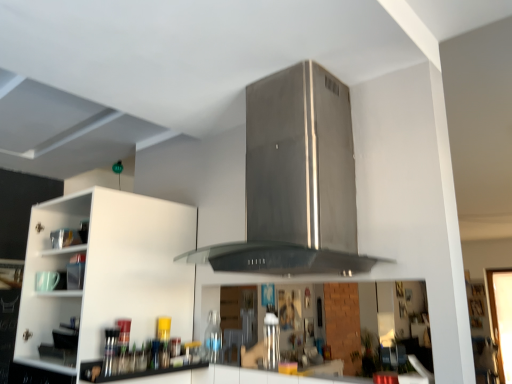
This screenshot has width=512, height=384. What are the coordinates of `stainless steel vent at center` in the screenshot? It's located at (296, 180).

Find the location of a particular element. The width and height of the screenshot is (512, 384). white matte cabinet at left is located at coordinates (106, 273).

Which of these two, transparent glass bottle at center or white matte cabinet at left, is wider?

white matte cabinet at left.

Is transparent glass bottle at center situated inside white matte cabinet at left or outside?

transparent glass bottle at center is spatially situated outside white matte cabinet at left.

What's the angular difference between transparent glass bottle at center and white matte cabinet at left's facing directions?

There is a 2.35-degree angle between the facing directions of transparent glass bottle at center and white matte cabinet at left.

Between transparent glass bottle at center and satin silver canister at center, which one appears on the right side from the viewer's perspective?

satin silver canister at center.

Which is behind, transparent glass bottle at center or satin silver canister at center?

transparent glass bottle at center.

Are transparent glass bottle at center and satin silver canister at center far apart?

They are positioned close to each other.

Based on their positions, is satin silver canister at center located to the left or right of stainless steel vent at center?

satin silver canister at center is positioned on stainless steel vent at center's left side.

Considering the points (274, 324) and (228, 248), which point is behind, point (274, 324) or point (228, 248)?

The point (274, 324) is more distant.

Is satin silver canister at center located outside stainless steel vent at center?

Absolutely, satin silver canister at center is external to stainless steel vent at center.

What's the angular difference between transparent glass bottle at center and stainless steel vent at center's facing directions?

The angle between the facing direction of transparent glass bottle at center and the facing direction of stainless steel vent at center is 2.13 degrees.

From the image's perspective, who appears lower, transparent glass bottle at center or stainless steel vent at center?

transparent glass bottle at center.

Based on the photo, from a real-world perspective, which object rests below the other?

transparent glass bottle at center is physically lower.

Based on the photo, is transparent glass bottle at center in front of or behind stainless steel vent at center in the image?

In the image, transparent glass bottle at center appears behind stainless steel vent at center.

This screenshot has width=512, height=384. Find the location of `cabinetry located above the satin silver canister at center (from a real-world perspective)`. cabinetry located above the satin silver canister at center (from a real-world perspective) is located at coordinates (106, 273).

Is satin silver canister at center completely or partially inside white matte cabinet at left?

That's incorrect, satin silver canister at center is not inside white matte cabinet at left.

Is white matte cabinet at left taller than satin silver canister at center?

Yes, white matte cabinet at left is taller than satin silver canister at center.

Locate an element on the screen. The image size is (512, 384). vent above the transparent glass bottle at center (from the image's perspective) is located at coordinates (296, 180).

Which is correct: stainless steel vent at center is inside transparent glass bottle at center, or outside of it?

stainless steel vent at center cannot be found inside transparent glass bottle at center.

Can you tell me how much stainless steel vent at center and transparent glass bottle at center differ in facing direction?

The facing directions of stainless steel vent at center and transparent glass bottle at center are 2.13 degrees apart.

Considering their positions, is stainless steel vent at center located in front of or behind transparent glass bottle at center?

stainless steel vent at center is in front of transparent glass bottle at center.

Is satin silver canister at center shorter than white matte cabinet at left?

Correct, satin silver canister at center is not as tall as white matte cabinet at left.

From the image's perspective, is satin silver canister at center above or below white matte cabinet at left?

From the image's perspective, satin silver canister at center appears below white matte cabinet at left.

Which object is further away from the camera, satin silver canister at center or white matte cabinet at left?

satin silver canister at center is more distant.

Is white matte cabinet at left at the back of satin silver canister at center?

No, white matte cabinet at left is not at the back of satin silver canister at center.

At what (x,y) coordinates should I click in order to perform the action: click on bottle below the white matte cabinet at left (from the image's perspective). Please return your answer as a coordinate pair (x, y). Looking at the image, I should click on (213, 338).

The image size is (512, 384). What are the coordinates of `bottle on the left of satin silver canister at center` in the screenshot? It's located at (213, 338).

Estimate the real-world distances between objects in this image. Which object is further from transparent glass bottle at center, white matte cabinet at left or satin silver canister at center?

Among the two, white matte cabinet at left is located further to transparent glass bottle at center.

Estimate the real-world distances between objects in this image. Which object is further from transparent glass bottle at center, satin silver canister at center or white matte cabinet at left?

white matte cabinet at left is further to transparent glass bottle at center.

From the image, which object appears to be farther from satin silver canister at center, stainless steel vent at center or transparent glass bottle at center?

Based on the image, stainless steel vent at center appears to be further to satin silver canister at center.

Based on their spatial positions, is satin silver canister at center or stainless steel vent at center closer to white matte cabinet at left?

The object closer to white matte cabinet at left is stainless steel vent at center.

From the image, which object appears to be nearer to satin silver canister at center, white matte cabinet at left or transparent glass bottle at center?

Among the two, transparent glass bottle at center is located nearer to satin silver canister at center.

Looking at this image, from the image, which object appears to be farther from satin silver canister at center, transparent glass bottle at center or stainless steel vent at center?

stainless steel vent at center.

When comparing their distances from satin silver canister at center, does transparent glass bottle at center or white matte cabinet at left seem further?

The object further to satin silver canister at center is white matte cabinet at left.

Considering their positions, is white matte cabinet at left positioned closer to satin silver canister at center than stainless steel vent at center?

Among the two, stainless steel vent at center is located nearer to satin silver canister at center.

This screenshot has height=384, width=512. I want to click on appliance located between stainless steel vent at center and transparent glass bottle at center in the depth direction, so click(271, 341).

The width and height of the screenshot is (512, 384). I want to click on appliance between white matte cabinet at left and stainless steel vent at center from left to right, so click(x=271, y=341).

Locate an element on the screen. This screenshot has height=384, width=512. bottle located between white matte cabinet at left and satin silver canister at center in the left-right direction is located at coordinates (213, 338).

Where is `cabinetry between stainless steel vent at center and transparent glass bottle at center along the z-axis`? This screenshot has width=512, height=384. cabinetry between stainless steel vent at center and transparent glass bottle at center along the z-axis is located at coordinates (106, 273).